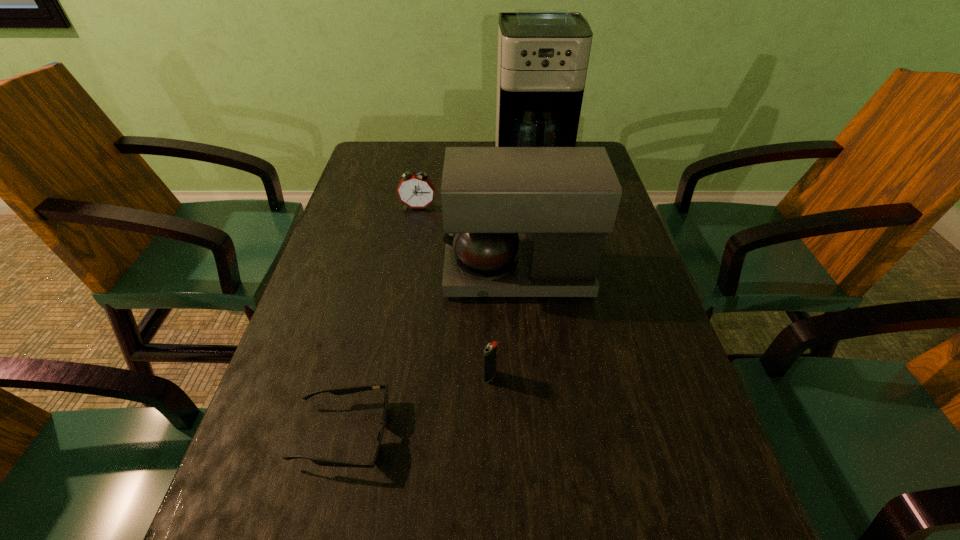
Image resolution: width=960 pixels, height=540 pixels. I want to click on object at the far right corner, so click(543, 54).

The width and height of the screenshot is (960, 540). I want to click on vacant region at the far edge of the desktop, so click(418, 151).

You are a GUI agent. You are given a task and a screenshot of the screen. Output one action in this format:
    pyautogui.click(x=<x>, y=<y>)
    Task: Click on the blank space at the left edge of the desktop
    
    Given the screenshot: What is the action you would take?
    pyautogui.click(x=373, y=214)

Identify the location of vacant space at the right edge of the desktop. The height and width of the screenshot is (540, 960). (674, 469).

Identify the location of vacant space at the far left corner of the desktop. This screenshot has height=540, width=960. (375, 141).

Where is `vacant space at the far right corner of the desktop`? This screenshot has width=960, height=540. vacant space at the far right corner of the desktop is located at coordinates (589, 141).

Locate an element on the screen. Image resolution: width=960 pixels, height=540 pixels. unoccupied area between the igniter and the shorter coffee maker is located at coordinates (504, 325).

I want to click on unoccupied position between the second nearest object and the fourth shortest object, so click(x=504, y=325).

You are a GUI agent. You are given a task and a screenshot of the screen. Output one action in this format:
    pyautogui.click(x=<x>, y=<y>)
    Task: Click on the second closest object relative to the third farthest object
    
    Given the screenshot: What is the action you would take?
    pyautogui.click(x=490, y=350)

What are the coordinates of `object that is the third closest to the third shortest object` in the screenshot? It's located at pos(490,350).